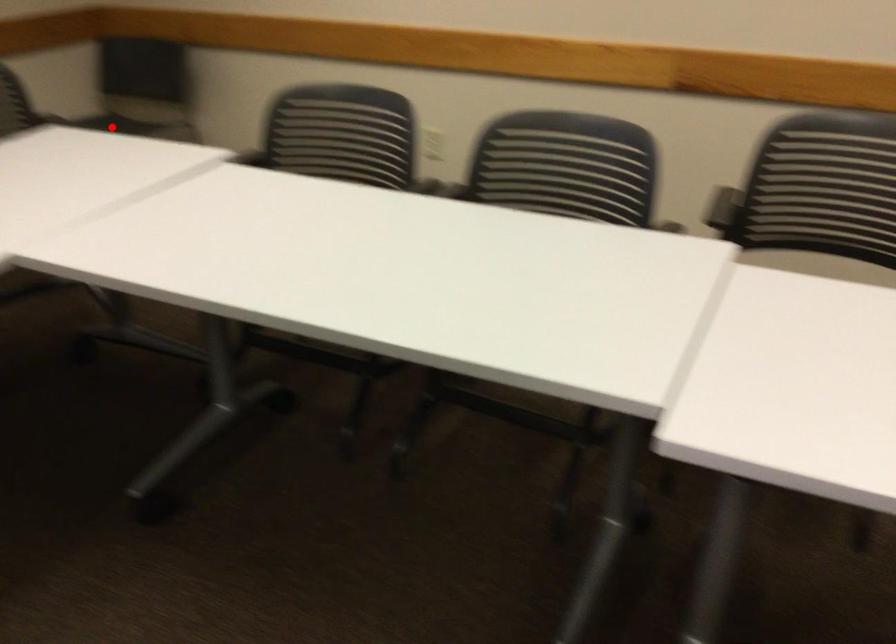
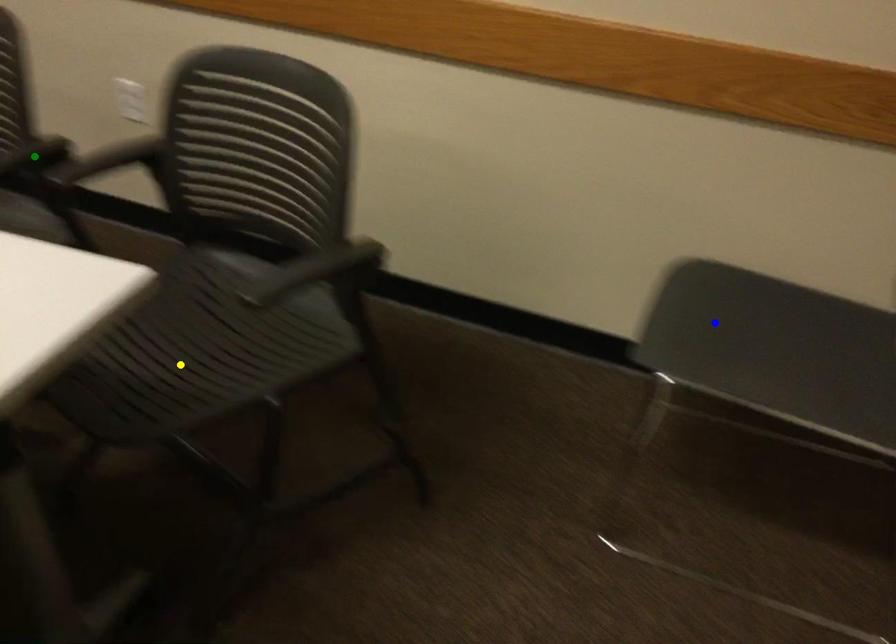
Question: I am providing you with two images of the same scene from different viewpoints. A red point is marked on the first image. You are given multiple points on the second image. In image 2, which mark is for the same physical point as the one in image 1?

Choices:
 (A) yellow point
 (B) blue point
 (C) green point

Answer: (B)